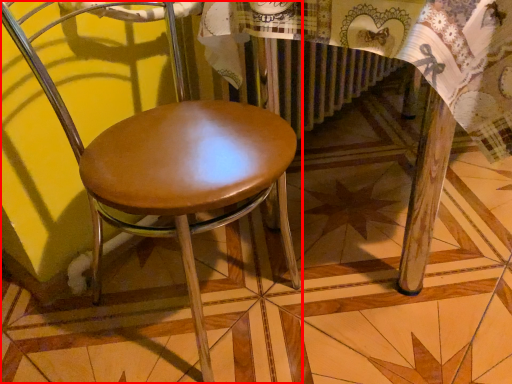
Question: Observing the image, what is the correct spatial positioning of chair (annotated by the red box) in reference to round table?

Choices:
 (A) right
 (B) left

Answer: (B)